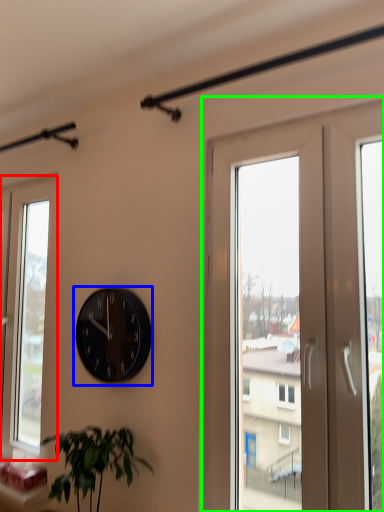
Question: Which object is the closest to the window (highlighted by a red box)? Choose among these: wall clock (highlighted by a blue box) or screen door (highlighted by a green box).

Choices:
 (A) wall clock
 (B) screen door

Answer: (A)